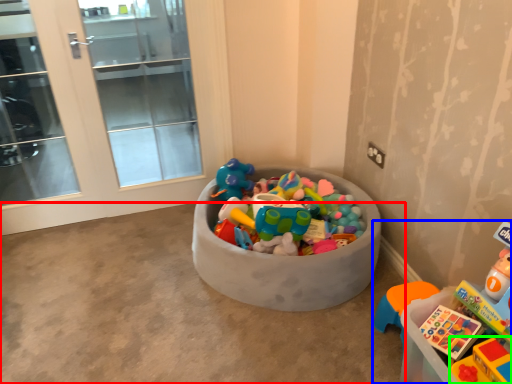
Question: Which is farther away from concrete (highlighted by a red box)? toy (highlighted by a blue box) or toy (highlighted by a green box)?

Choices:
 (A) toy
 (B) toy

Answer: (B)